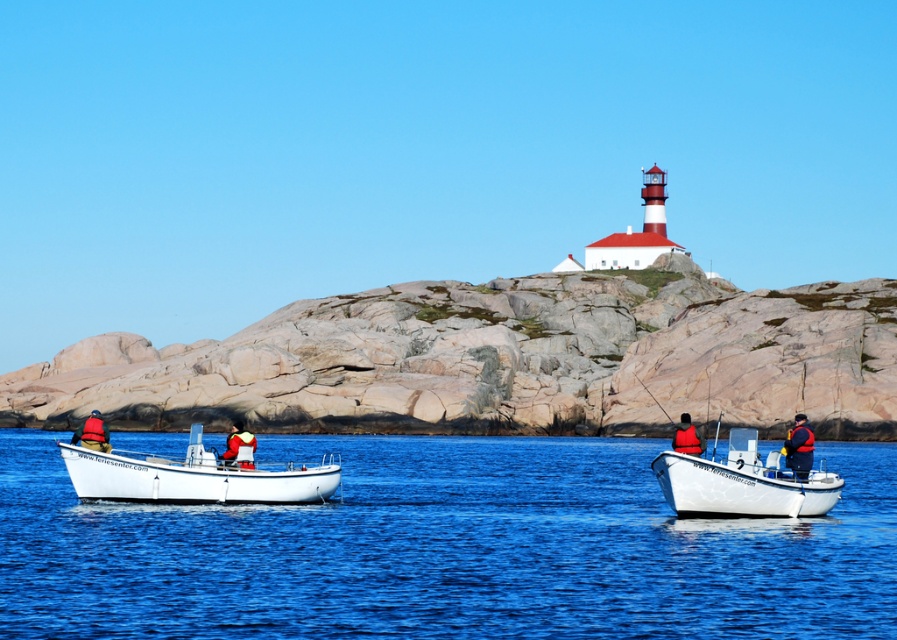
Between point (790, 508) and point (692, 440), which one is positioned in front?

Point (790, 508)

Does point (733, 435) come in front of point (704, 445)?

No, it is behind (704, 445).

The image size is (897, 640). Find the location of `white matte boat at center`. white matte boat at center is located at coordinates (742, 483).

Is orange life vest at center further to the viewer compared to red life jacket at center?

Yes, it is behind red life jacket at center.

Who is more distant from viewer, (x=794, y=426) or (x=251, y=444)?

The point (x=794, y=426) is behind.

Find the location of a particular element. This screenshot has height=640, width=897. orange life vest at center is located at coordinates (799, 445).

Can you confirm if orange life vest at center is positioned above red life vest at left?

No.

Where is `orange life vest at center`? The image size is (897, 640). orange life vest at center is located at coordinates (799, 445).

At what (x,y) coordinates should I click in order to perform the action: click on orange life vest at center. Please return your answer as a coordinate pair (x, y). The width and height of the screenshot is (897, 640). Looking at the image, I should click on (799, 445).